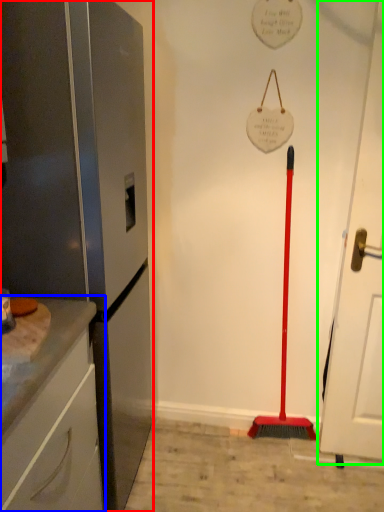
Question: Estimate the real-world distances between objects in this image. Which object is farther from appliance (highlighted by a red box), cabinetry (highlighted by a blue box) or door (highlighted by a green box)?

Choices:
 (A) cabinetry
 (B) door

Answer: (B)